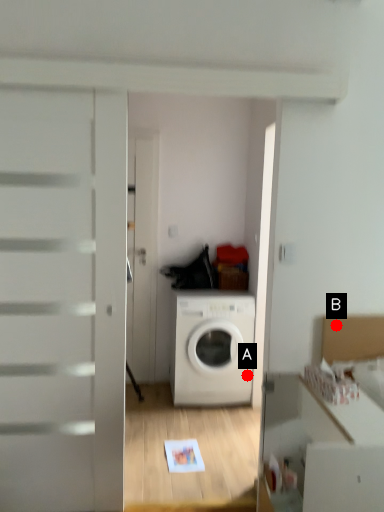
Question: Two points are circled on the image, labeled by A and B beside each circle. Which point appears closest to the camera in this image?

Choices:
 (A) A is closer
 (B) B is closer

Answer: (B)